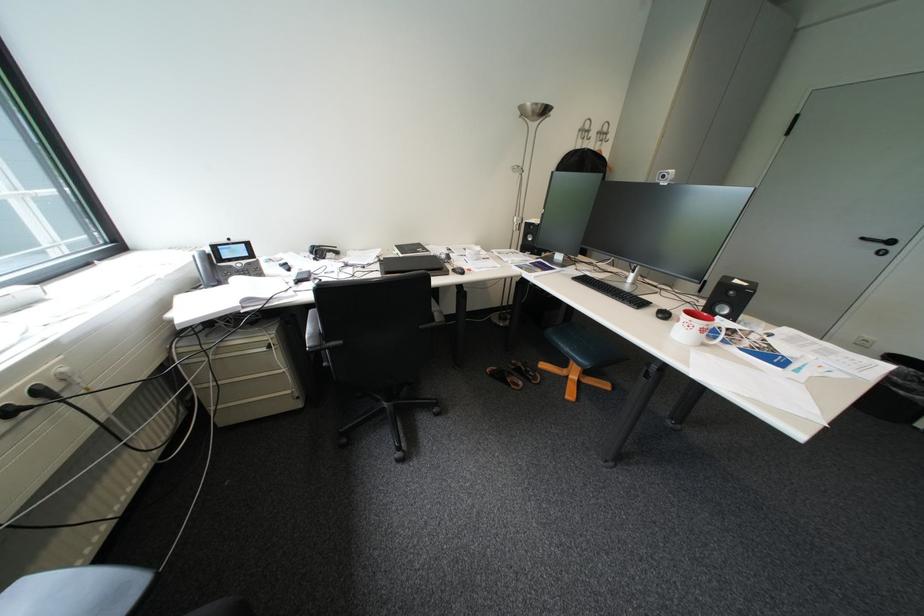
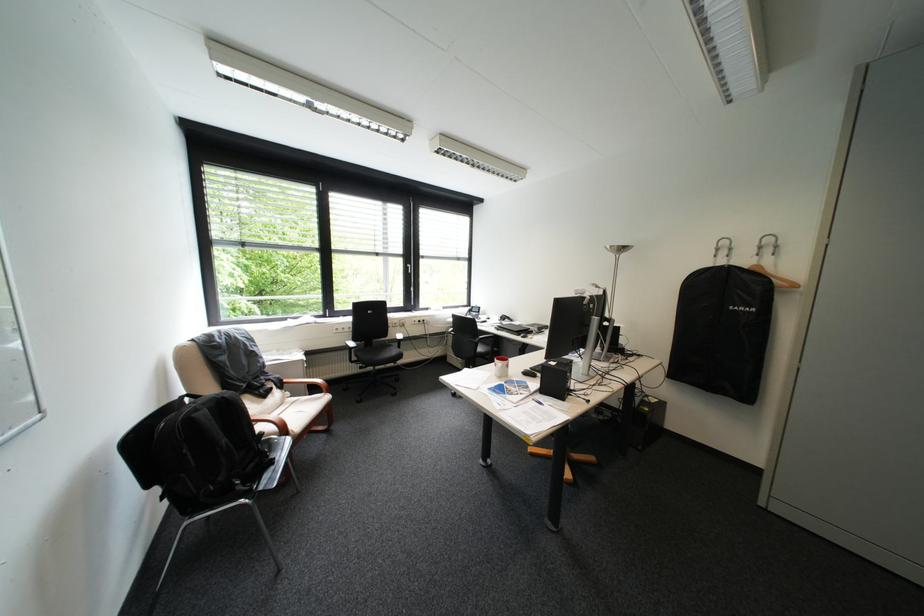
Question: I am providing you with two images of the same scene from different viewpoints. Please identify which objects are invisible in image2.

Choices:
 (A) brown sandal
 (B) wooden clothes hanger
 (C) black garment bag
 (D) brown library binder

Answer: (A)